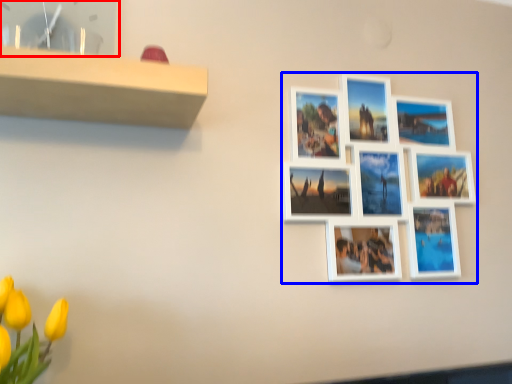
Question: Which point is further to the camera, picture frame (highlighted by a red box) or picture frame (highlighted by a blue box)?

Choices:
 (A) picture frame
 (B) picture frame

Answer: (B)